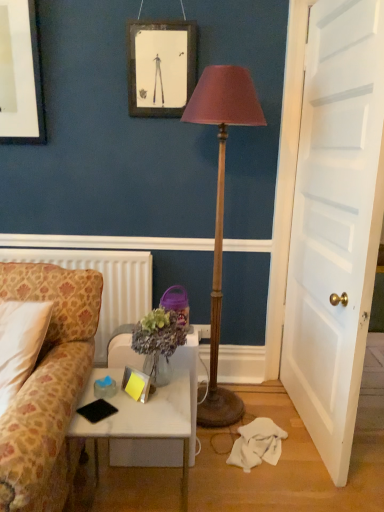
Question: Looking at their shapes, would you say white wooden door at right is wider or thinner than patterned fabric couch at left?

Choices:
 (A) thin
 (B) wide

Answer: (A)

Question: Does point (304, 418) appear closer or farther from the camera than point (79, 377)?

Choices:
 (A) closer
 (B) farther

Answer: (B)

Question: Which object is the closest to the wooden framed picture at upper center?

Choices:
 (A) blue translucent cup at lower left
 (B) patterned fabric couch at left
 (C) wooden floor lamp at center
 (D) white wooden door at right
 (E) white marble desk at lower left

Answer: (C)

Question: Which object is positioned farthest from the white wooden door at right?

Choices:
 (A) white textured radiator at left
 (B) wooden framed picture at upper center
 (C) blue translucent cup at lower left
 (D) wooden floor lamp at center
 (E) white marble desk at lower left

Answer: (C)